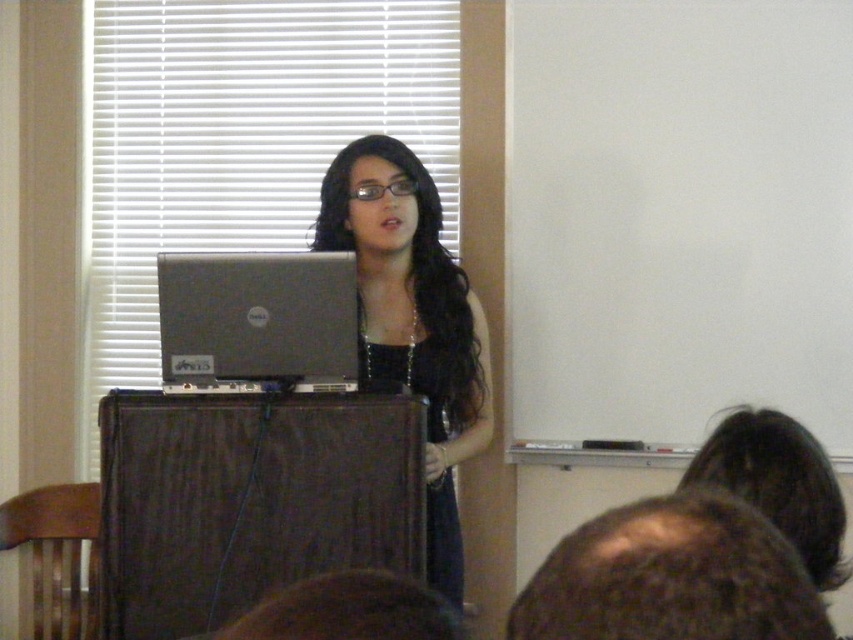
Based on the photo, you are a photographer in the classroom. You need to capture a clear photo of both the matte black dress at center and the brown fuzzy hair at lower right. Which object will appear bigger in the photo?

The matte black dress at center will appear bigger in the photo because it has a larger size compared to the brown fuzzy hair at lower right.

You are an attendee sitting in the front row of the classroom. You notice the matte black dress at center and the silver metallic laptop at center. Which object is closer to the floor?

The matte black dress at center is positioned under the silver metallic laptop at center, so the dress is closer to the floor.

You are sitting in the front row of the classroom and want to look at both the point at coordinates (434, 208) and the point at coordinates (747, 541). Which point will appear closer to you?

The point at coordinates (434, 208) will appear closer to you because it is further to the camera than the point at coordinates (747, 541), meaning it is physically nearer in the scene.